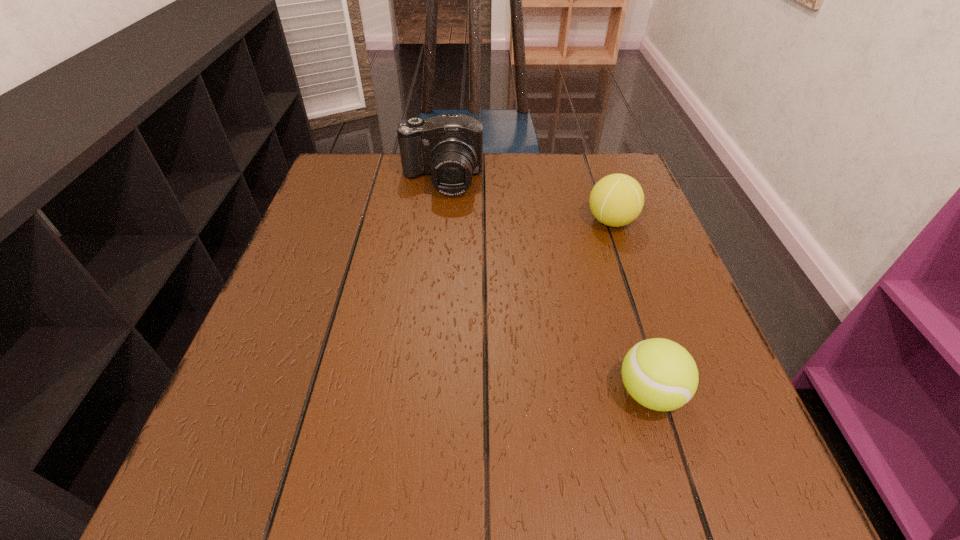
Locate an element on the screen. The width and height of the screenshot is (960, 540). blank space at the right edge of the desktop is located at coordinates (636, 300).

In the image, there is a desktop. Where is `vacant space at the far right corner`? The width and height of the screenshot is (960, 540). vacant space at the far right corner is located at coordinates (611, 166).

In the image, there is a desktop. Identify the location of vacant space at the near right corner. The height and width of the screenshot is (540, 960). (658, 487).

The image size is (960, 540). I want to click on unoccupied area between the second farthest object and the nearest object, so click(631, 307).

The height and width of the screenshot is (540, 960). What are the coordinates of `free space between the leftmost object and the nearer tennis ball` in the screenshot? It's located at (545, 287).

Where is `free space between the tallest object and the nearer tennis ball`? free space between the tallest object and the nearer tennis ball is located at coordinates (545, 287).

Identify the location of unoccupied position between the nearest object and the leftmost object. (545, 287).

I want to click on empty location between the farther tennis ball and the nearer tennis ball, so click(x=631, y=307).

Identify the location of vacant area between the leftmost object and the farther tennis ball. The image size is (960, 540). (526, 201).

The height and width of the screenshot is (540, 960). What are the coordinates of `free space that is in between the nearest object and the second farthest object` in the screenshot? It's located at (631, 307).